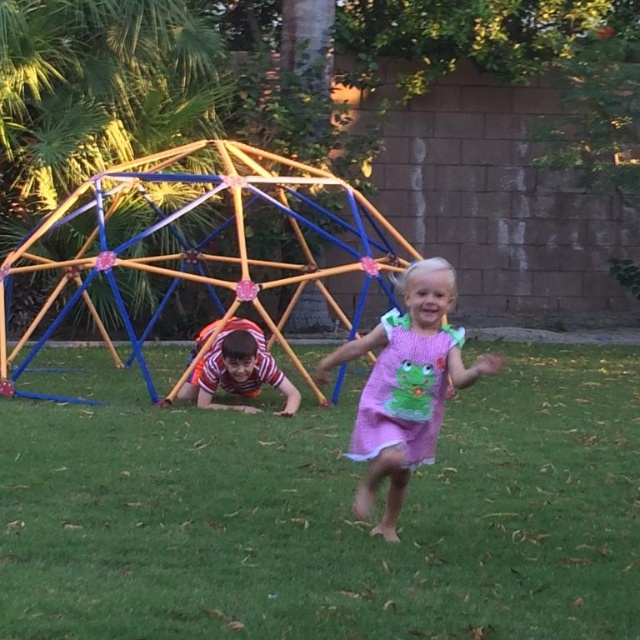
You are standing at the center of the image and want to place a small garden gnome exactly where the green grass at center is located. What are the coordinates where you should place it?

The coordinates for the green grass at center are at point (x=323, y=513), so you should place the garden gnome there.